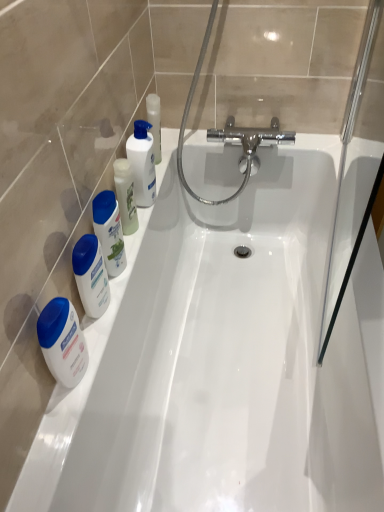
Locate an element on the screen. The width and height of the screenshot is (384, 512). free location in front of white glossy lotion at left, the 3th mouthwash viewed from the top is located at coordinates (56, 434).